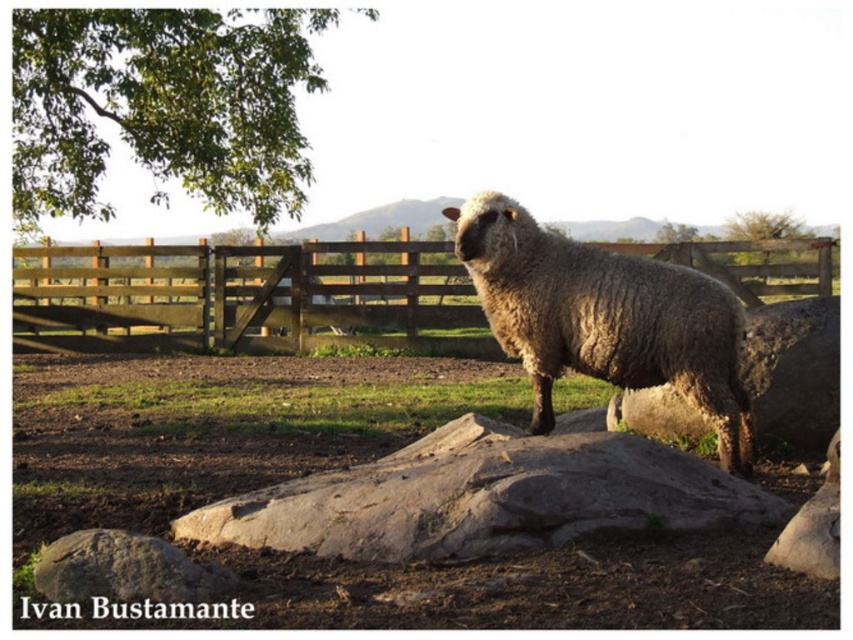
You are a photographer trying to capture the fuzzy woolly sheep at center without the green leafy tree at upper left blocking the view. Based on the scene, can you position yourself in a way to avoid the tree obstructing the sheep?

The green leafy tree at upper left is positioned over the fuzzy woolly sheep at center, so if you move to a lower angle or position yourself below the sheep, you can avoid the tree blocking the view.

In the pastoral scene, there is a green leafy tree at upper left and a fuzzy woolly sheep at center. From the perspective of someone standing where the camera is, which object is positioned to the left?

The green leafy tree at upper left is positioned to the left of the fuzzy woolly sheep at center.

You are standing in the fenced enclosure with the sheep and want to take a photo of the green leafy tree at upper left. Where should you position yourself to ensure the tree is in the frame?

To capture the green leafy tree at upper left in your photo, position yourself near the center of the fenced enclosure so the tree remains visible at its upper left corner, as it is located at coordinates approximately 0.167 on the x and 0.192 on the y axis.